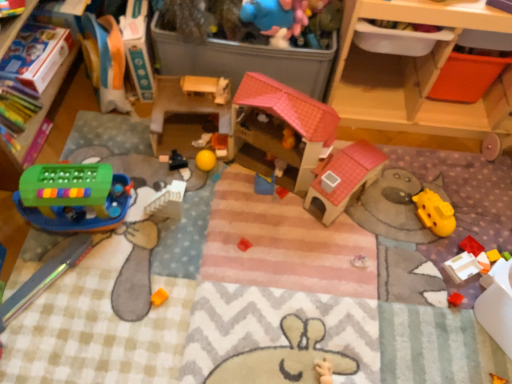
At what (x,y) coordinates should I click in order to perform the action: click on free point in front of white plastic block at lower right, the 2th toy positioned from the right. Please return your answer as a coordinate pair (x, y). This screenshot has height=384, width=512. Looking at the image, I should click on [x=457, y=322].